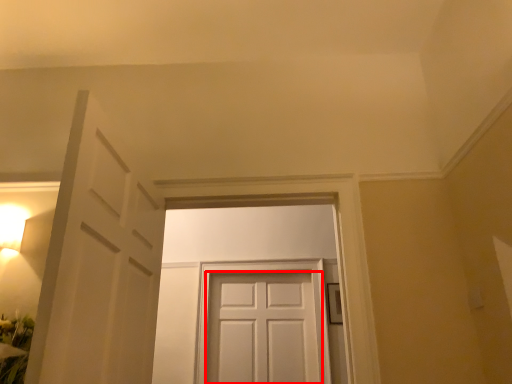
Question: From the image, what is the correct spatial relationship of door (annotated by the red box) in relation to door?

Choices:
 (A) right
 (B) left

Answer: (A)